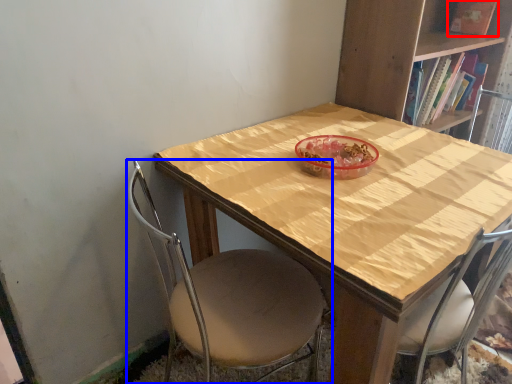
Question: Which object appears farthest to the camera in this image, book (highlighted by a red box) or chair (highlighted by a blue box)?

Choices:
 (A) book
 (B) chair

Answer: (A)